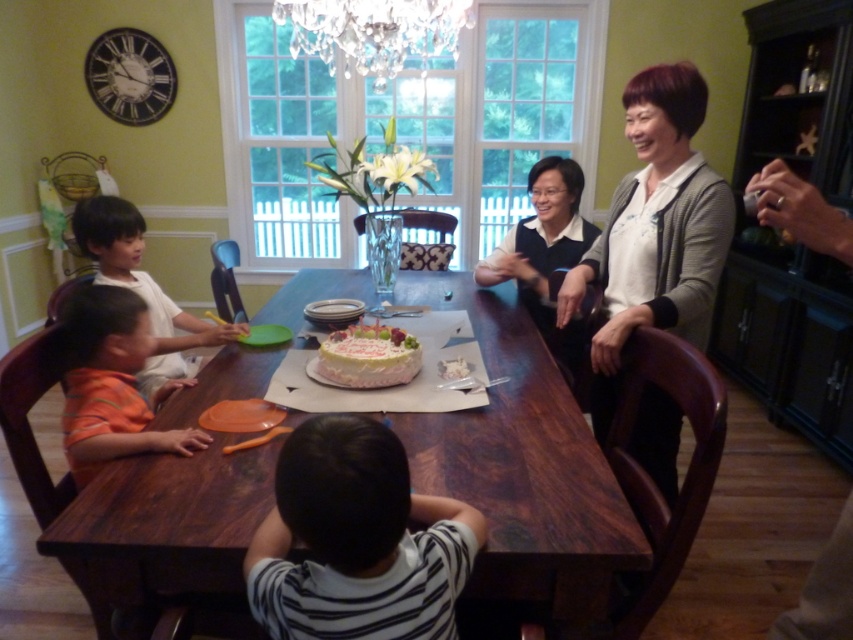
Can you confirm if white knit sweater at upper right is thinner than smooth skin child at left?

Correct, white knit sweater at upper right's width is less than smooth skin child at left's.

In the scene shown: Who is more forward, [668,314] or [160,368]?

Positioned in front is point [668,314].

Image resolution: width=853 pixels, height=640 pixels. Identify the location of white knit sweater at upper right. (654, 230).

Locate an element on the screen. This screenshot has width=853, height=640. striped fabric shirt at lower center is located at coordinates (357, 540).

Can you confirm if striped fabric shirt at lower center is shorter than white knit sweater at upper right?

Indeed, striped fabric shirt at lower center has a lesser height compared to white knit sweater at upper right.

Locate an element on the screen. striped fabric shirt at lower center is located at coordinates (357, 540).

In order to click on striped fabric shirt at lower center in this screenshot , I will do `click(357, 540)`.

Between point (444, 451) and point (236, 328), which one is positioned in front?

Positioned in front is point (444, 451).

Is wooden table at center positioned at the back of smooth skin child at left?

No, it is in front of smooth skin child at left.

Between point (175, 548) and point (190, 372), which one is positioned behind?

The point (190, 372) is behind.

Where is `wooden table at center`? This screenshot has width=853, height=640. wooden table at center is located at coordinates 523,467.